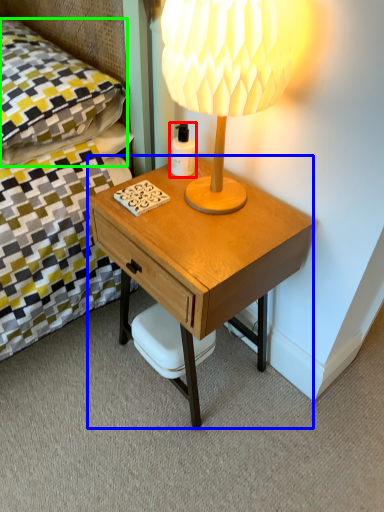
Question: Estimate the real-world distances between objects in this image. Which object is farther from bottle (highlighted by a red box), desk (highlighted by a blue box) or pillow (highlighted by a green box)?

Choices:
 (A) desk
 (B) pillow

Answer: (B)